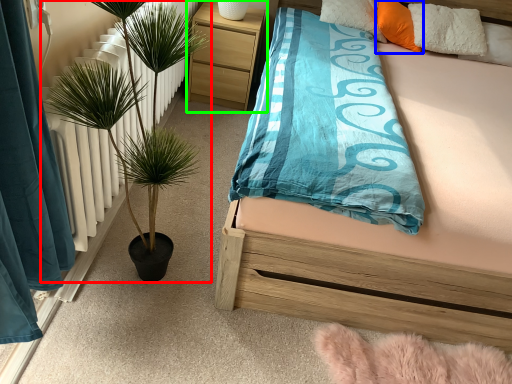
Question: Based on their relative distances, which object is nearer to houseplant (highlighted by a red box)? Choose from pillow (highlighted by a blue box) and nightstand (highlighted by a green box).

Choices:
 (A) pillow
 (B) nightstand

Answer: (B)